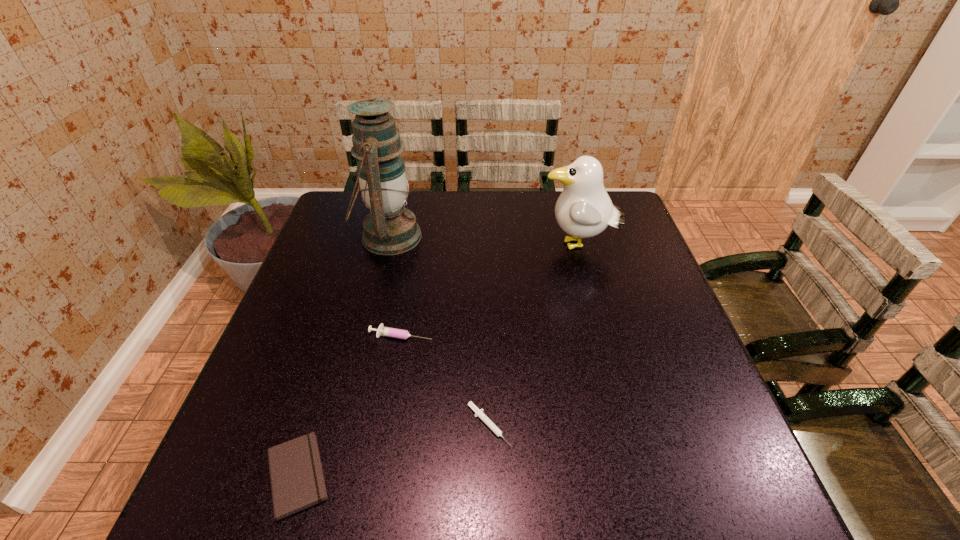
Identify the location of free space located 0.400m on the beak of the second tallest object. This screenshot has width=960, height=540. (403, 246).

Where is `vacant area located 0.170m on the beak of the second tallest object`? The width and height of the screenshot is (960, 540). vacant area located 0.170m on the beak of the second tallest object is located at coordinates (482, 246).

Where is `free space located 0.230m on the back of the left syringe`? This screenshot has height=540, width=960. free space located 0.230m on the back of the left syringe is located at coordinates (414, 266).

Identify the location of free space located 0.070m on the back of the nearer syringe. (489, 375).

I want to click on blank space located on the right of the checkbook, so click(x=377, y=475).

Identify the location of oil lamp at the far edge. coord(389,229).

Find the location of `gull situated at the far edge`. gull situated at the far edge is located at coordinates (584, 209).

The width and height of the screenshot is (960, 540). What are the coordinates of `object that is at the near edge` in the screenshot? It's located at 297,482.

Where is `oil lamp that is at the left edge`? oil lamp that is at the left edge is located at coordinates (389, 229).

The width and height of the screenshot is (960, 540). Identify the location of checkbook at the left edge. (297, 482).